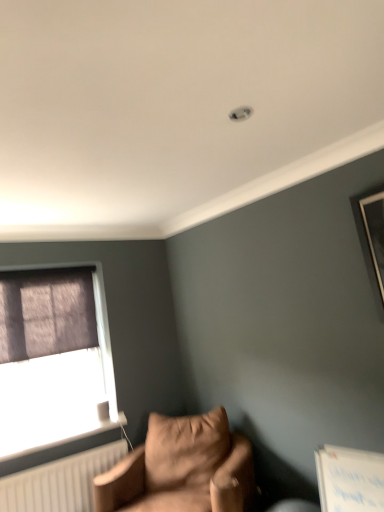
In order to face matte purple curtain at left, should I rotate leftwards or rightwards?

Turn left by 18.553 degrees to look at matte purple curtain at left.

Image resolution: width=384 pixels, height=512 pixels. What do you see at coordinates (57, 371) in the screenshot?
I see `matte purple curtain at left` at bounding box center [57, 371].

The height and width of the screenshot is (512, 384). Find the location of `suede-like brown armchair at lower left`. suede-like brown armchair at lower left is located at coordinates (182, 468).

In order to click on dark purple fabric at left in this screenshot , I will do `click(46, 313)`.

What are the coordinates of `matte purple curtain at left` in the screenshot? It's located at (57, 371).

Does point (169, 475) appear closer or farther from the camera than point (3, 434)?

Point (169, 475) is positioned farther from the camera compared to point (3, 434).

What's the angular difference between suede-like brown armchair at lower left and matte purple curtain at left's facing directions?

There is a 61.6-degree angle between the facing directions of suede-like brown armchair at lower left and matte purple curtain at left.

From the image's perspective, who appears lower, suede-like brown armchair at lower left or matte purple curtain at left?

suede-like brown armchair at lower left, from the image's perspective.

In terms of width, does suede-like brown armchair at lower left look wider or thinner when compared to matte purple curtain at left?

Clearly, suede-like brown armchair at lower left has more width compared to matte purple curtain at left.

Does suede-like brown armchair at lower left turn towards dark purple fabric at left?

No, suede-like brown armchair at lower left is not facing towards dark purple fabric at left.

Considering the relative positions of suede-like brown armchair at lower left and dark purple fabric at left in the image provided, is suede-like brown armchair at lower left behind dark purple fabric at left?

No, it is not.

Is suede-like brown armchair at lower left wider than dark purple fabric at left?

Yes.

Measure the distance from suede-like brown armchair at lower left to dark purple fabric at left.

They are 1.11 meters apart.

From the image's perspective, is dark purple fabric at left below matte purple curtain at left?

No, from the image's perspective, dark purple fabric at left is not below matte purple curtain at left.

Can we say dark purple fabric at left lies outside matte purple curtain at left?

That's correct, dark purple fabric at left is outside of matte purple curtain at left.

The image size is (384, 512). I want to click on curtain lying in front of the matte purple curtain at left, so click(x=46, y=313).

In the scene shown: In terms of height, does dark purple fabric at left look taller or shorter compared to matte purple curtain at left?

In the image, dark purple fabric at left appears to be shorter than matte purple curtain at left.

Based on the photo, from a real-world perspective, is matte purple curtain at left over suede-like brown armchair at lower left?

Yes, from a real-world perspective, matte purple curtain at left is over suede-like brown armchair at lower left

Is suede-like brown armchair at lower left located within matte purple curtain at left?

No, suede-like brown armchair at lower left is not a part of matte purple curtain at left.

Is point (38, 391) in front of point (251, 448)?

No, (38, 391) is further to viewer.

Who is more distant, dark purple fabric at left or white plastic radiator at lower left?

dark purple fabric at left.

Is dark purple fabric at left beside white plastic radiator at lower left?

There is a gap between dark purple fabric at left and white plastic radiator at lower left.

Locate an element on the screen. This screenshot has height=512, width=384. window sill located underneath the dark purple fabric at left (from a real-world perspective) is located at coordinates (63, 440).

From a real-world perspective, which is physically above, dark purple fabric at left or white plastic radiator at lower left?

dark purple fabric at left, from a real-world perspective.

From a real-world perspective, which is physically below, matte purple curtain at left or dark purple fabric at left?

In real-world perspective, matte purple curtain at left is lower.

Does point (49, 405) appear closer or farther from the camera than point (4, 337)?

Point (49, 405) is farther from the camera than point (4, 337).

Considering the positions of objects matte purple curtain at left and dark purple fabric at left in the image provided, who is more to the left, matte purple curtain at left or dark purple fabric at left?

From the viewer's perspective, matte purple curtain at left appears more on the left side.

In the image, there is a matte purple curtain at left. In order to click on window sill below it (from a real-world perspective) in this screenshot , I will do `click(63, 440)`.

From their relative heights in the image, would you say matte purple curtain at left is taller or shorter than white plastic radiator at lower left?

Considering their sizes, matte purple curtain at left has more height than white plastic radiator at lower left.

Between matte purple curtain at left and white plastic radiator at lower left, which one has smaller size?

white plastic radiator at lower left.

What are the coordinates of `window that appears above the suede-like brown armchair at lower left (from a real-world perspective)` in the screenshot? It's located at (57, 371).

This screenshot has width=384, height=512. What are the coordinates of `studio couch on the right of dark purple fabric at left` in the screenshot? It's located at (182, 468).

Looking at the image, which one is located further to dark purple fabric at left, matte purple curtain at left or suede-like brown armchair at lower left?

Among the two, suede-like brown armchair at lower left is located further to dark purple fabric at left.

Considering their positions, is suede-like brown armchair at lower left positioned closer to dark purple fabric at left than matte purple curtain at left?

The object closer to dark purple fabric at left is matte purple curtain at left.

Which object lies further to the anchor point suede-like brown armchair at lower left, matte purple curtain at left or dark purple fabric at left?

dark purple fabric at left is positioned further to the anchor suede-like brown armchair at lower left.

Looking at the image, which one is located further to dark purple fabric at left, suede-like brown armchair at lower left or white plastic radiator at lower left?

suede-like brown armchair at lower left is further to dark purple fabric at left.

From the image, which object appears to be farther from white plastic radiator at lower left, dark purple fabric at left or suede-like brown armchair at lower left?

dark purple fabric at left lies further to white plastic radiator at lower left than the other object.

Which object lies further to the anchor point white plastic radiator at lower left, matte purple curtain at left or suede-like brown armchair at lower left?

suede-like brown armchair at lower left is further to white plastic radiator at lower left.

When comparing their distances from white plastic radiator at lower left, does suede-like brown armchair at lower left or matte purple curtain at left seem closer?

Based on the image, matte purple curtain at left appears to be nearer to white plastic radiator at lower left.

From the image, which object appears to be nearer to white plastic radiator at lower left, dark purple fabric at left or matte purple curtain at left?

matte purple curtain at left is closer to white plastic radiator at lower left.

The width and height of the screenshot is (384, 512). Identify the location of window sill situated between matte purple curtain at left and suede-like brown armchair at lower left from left to right. (63, 440).

You are a GUI agent. You are given a task and a screenshot of the screen. Output one action in this format:
    pyautogui.click(x=<x>, y=<y>)
    Task: Click on the curtain between matte purple curtain at left and suede-like brown armchair at lower left
    This screenshot has height=512, width=384.
    Given the screenshot: What is the action you would take?
    pyautogui.click(x=46, y=313)

Where is `window sill that lies between dark purple fabric at left and suede-like brown armchair at lower left from top to bottom`? This screenshot has width=384, height=512. window sill that lies between dark purple fabric at left and suede-like brown armchair at lower left from top to bottom is located at coordinates (63, 440).

Identify the location of window between dark purple fabric at left and white plastic radiator at lower left from top to bottom. (57, 371).